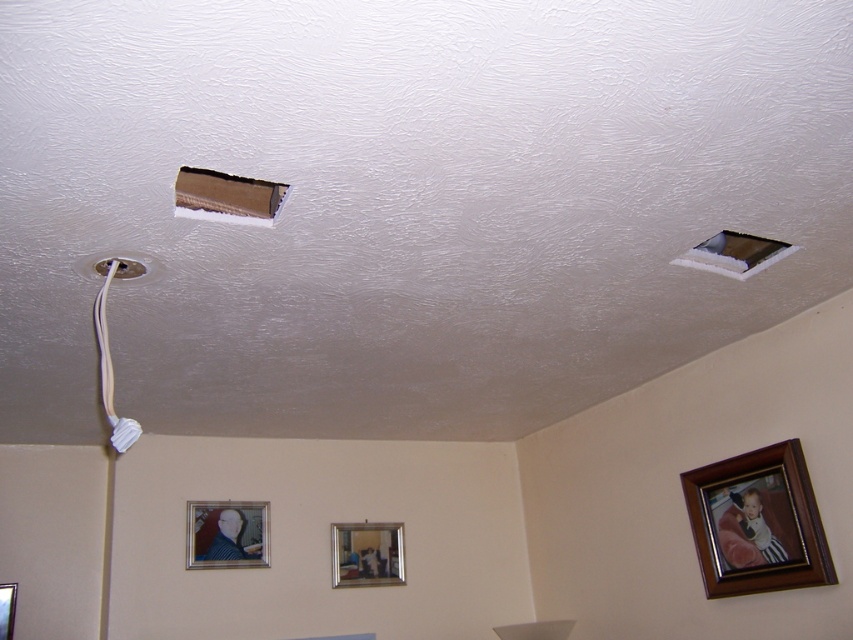
Looking at this image, does wooden picture frame at lower right have a lesser width compared to matte silver picture frame at lower left?

Indeed, wooden picture frame at lower right has a lesser width compared to matte silver picture frame at lower left.

Which of these two, wooden picture frame at lower right or matte silver picture frame at lower left, stands taller?

Standing taller between the two is wooden picture frame at lower right.

What do you see at coordinates (757, 522) in the screenshot? I see `wooden picture frame at lower right` at bounding box center [757, 522].

Locate an element on the screen. wooden picture frame at lower right is located at coordinates (757, 522).

Between smooth white ceiling hole at upper right and white plastic hole at upper left, which one appears on the right side from the viewer's perspective?

smooth white ceiling hole at upper right

Who is shorter, smooth white ceiling hole at upper right or white plastic hole at upper left?

Standing shorter between the two is white plastic hole at upper left.

Which is behind, point (770, 252) or point (137, 273)?

The point (770, 252) is behind.

Locate an element on the screen. smooth white ceiling hole at upper right is located at coordinates (735, 250).

Is wooden picture frame at center below white plastic hole at upper left?

Yes, wooden picture frame at center is below white plastic hole at upper left.

Describe the element at coordinates (367, 554) in the screenshot. The width and height of the screenshot is (853, 640). I see `wooden picture frame at center` at that location.

Image resolution: width=853 pixels, height=640 pixels. What are the coordinates of `wooden picture frame at center` in the screenshot? It's located at (367, 554).